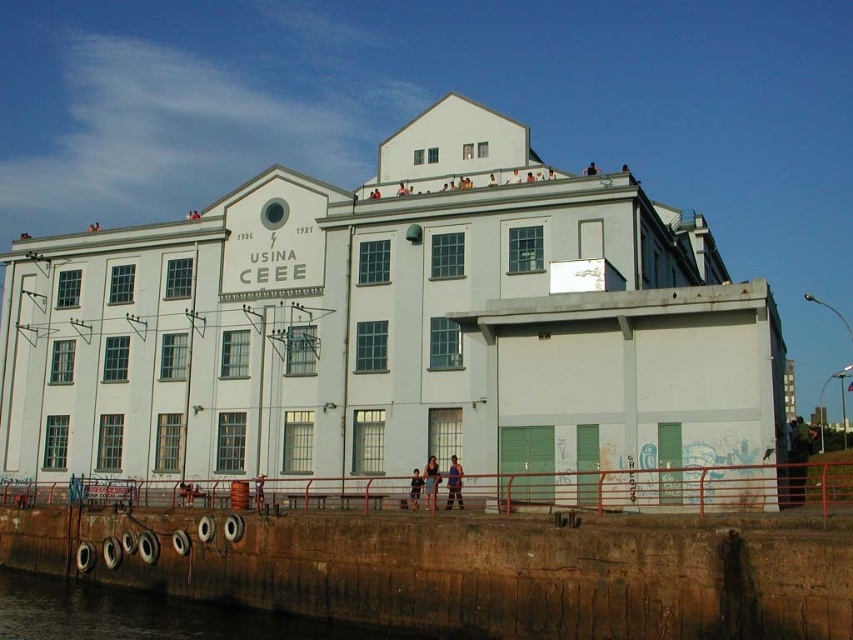
Which is more to the left, brown concrete water at lower left or matte black shirt at center?

From the viewer's perspective, brown concrete water at lower left appears more on the left side.

Can you confirm if brown concrete water at lower left is bigger than matte black shirt at center?

Correct, brown concrete water at lower left is larger in size than matte black shirt at center.

Identify the location of brown concrete water at lower left. The height and width of the screenshot is (640, 853). (149, 616).

The image size is (853, 640). What are the coordinates of `brown concrete water at lower left` in the screenshot? It's located at (149, 616).

The image size is (853, 640). Identify the location of matte black shirt at center. (454, 483).

Who is taller, matte black shirt at center or dark blue jeans at lower center?

With more height is matte black shirt at center.

Who is more distant from viewer, (x=461, y=484) or (x=430, y=465)?

The point (x=430, y=465) is more distant.

This screenshot has height=640, width=853. In order to click on matte black shirt at center in this screenshot , I will do coord(454,483).

Between point (457, 497) and point (409, 490), which one is positioned behind?

The point (409, 490) is behind.

Where is `matte black shirt at center`? matte black shirt at center is located at coordinates (454, 483).

I want to click on matte black shirt at center, so [454, 483].